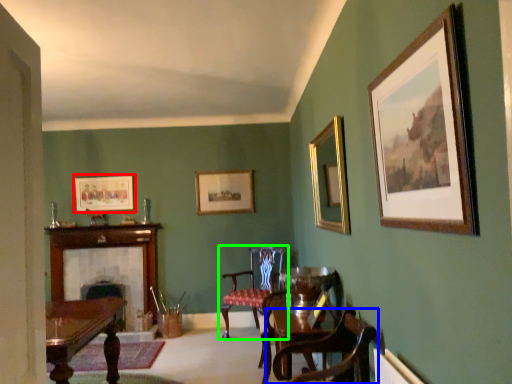
Question: Based on their relative distances, which object is farther from picture frame (highlighted by a red box)? Choose from chair (highlighted by a blue box) and chair (highlighted by a green box).

Choices:
 (A) chair
 (B) chair

Answer: (A)